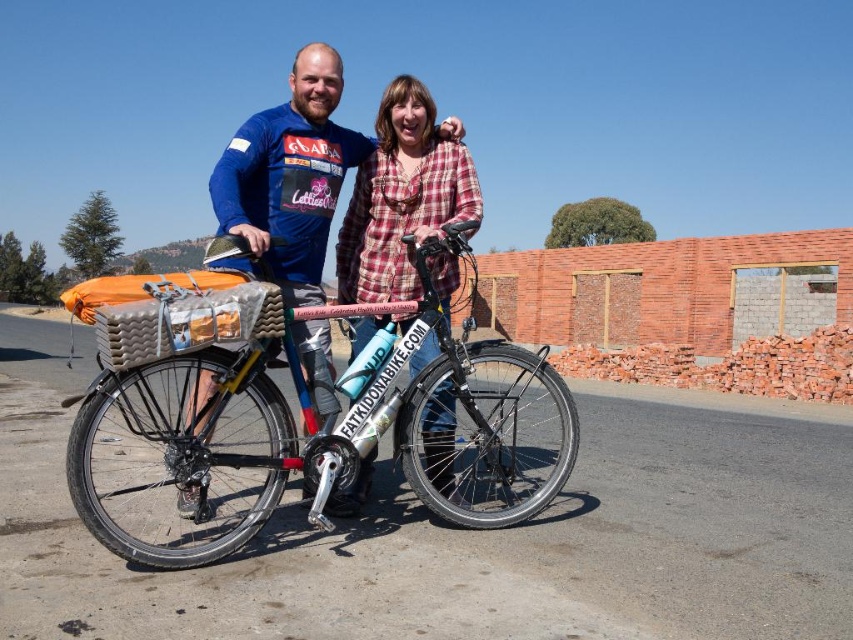
You are a photographer standing at a certain distance from the brushed metal bicycle at center. If your camera can only focus on objects within 10 feet, will you need to move closer or farther away to capture a clear photo of the bicycle?

The brushed metal bicycle at center is 12.94 feet from the camera, which is beyond the 10 feet focus range. To capture a clear photo, you need to move farther away to increase the distance, but since the camera can only focus within 10 feet, moving closer would decrease the distance. Wait, actually, to be within the 10 feet range, you need to move closer so that the distance becomes less than or equal to 10 feet. The current distance is 12.94 feet, so moving closer reduces the distance, bringing it within 1